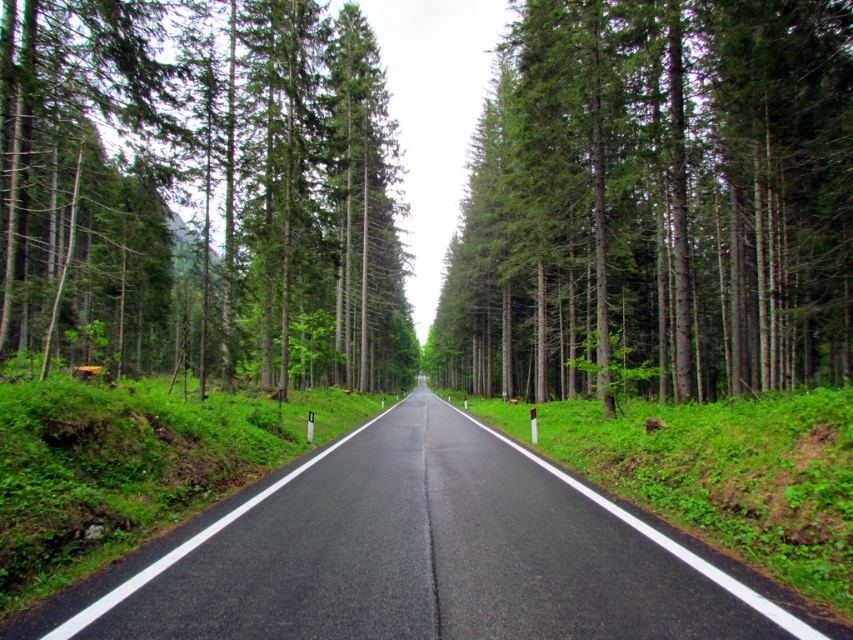
Question: Does green matte tree at left lie in front of asphalt road at center?

Choices:
 (A) no
 (B) yes

Answer: (A)

Question: Can you confirm if green matte tree at center is positioned to the left of green matte tree at left?

Choices:
 (A) yes
 (B) no

Answer: (B)

Question: Among these objects, which one is nearest to the camera?

Choices:
 (A) green matte tree at left
 (B) asphalt road at center
 (C) green matte tree at center

Answer: (B)

Question: Estimate the real-world distances between objects in this image. Which object is closer to the green matte tree at center?

Choices:
 (A) asphalt road at center
 (B) green matte tree at left

Answer: (B)

Question: Estimate the real-world distances between objects in this image. Which object is farther from the asphalt road at center?

Choices:
 (A) green matte tree at center
 (B) green matte tree at left

Answer: (B)

Question: Is green matte tree at left positioned in front of asphalt road at center?

Choices:
 (A) no
 (B) yes

Answer: (A)